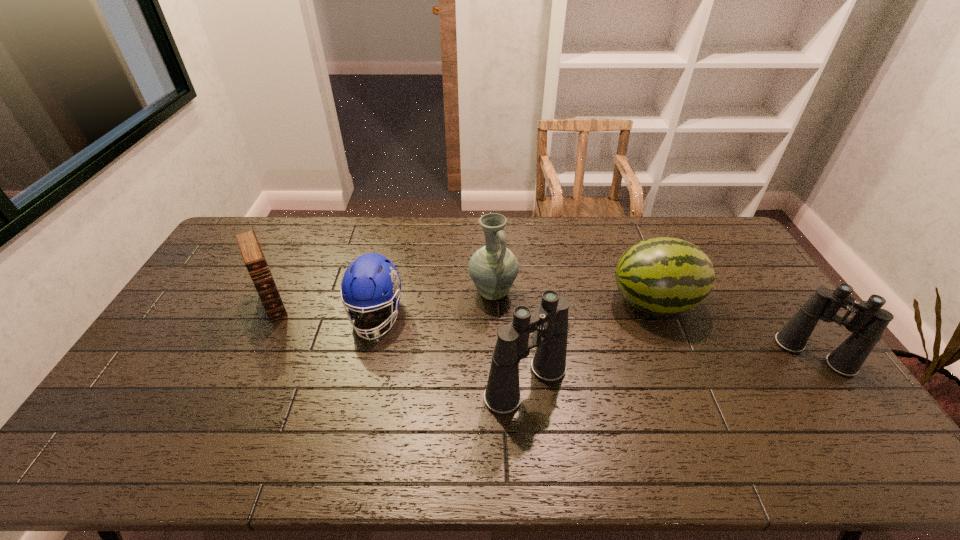
Locate an element on the screen. free location that satisfies the following two spatial constraints: 1. on the back side of the shorter binoculars; 2. at the stem end of the watermelon is located at coordinates (778, 302).

The width and height of the screenshot is (960, 540). I want to click on vacant space that satisfies the following two spatial constraints: 1. at the stem end of the fifth object from left to right; 2. on the front side of the leftmost object, so click(655, 303).

This screenshot has width=960, height=540. What are the coordinates of `blank area in the image that satisfies the following two spatial constraints: 1. on the handle side of the pitcher; 2. on the left side of the taller binoculars` in the screenshot? It's located at (495, 383).